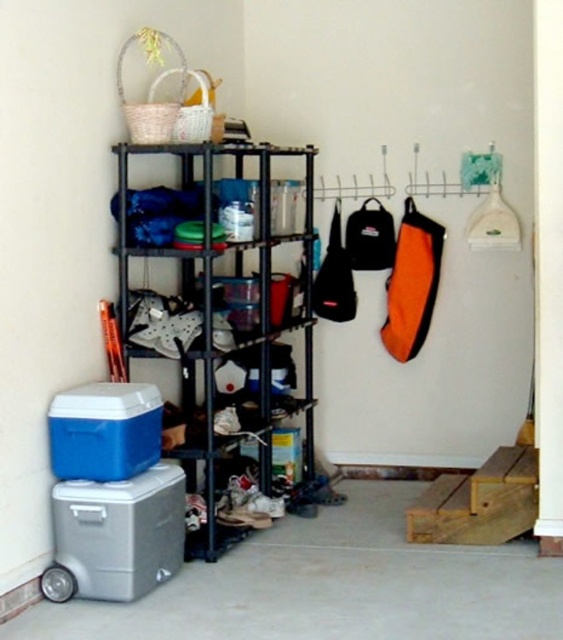
You are moving a gray plastic cooler at lower left and want to place it in front of the black metal shelf at center. Is the cooler currently positioned behind the shelf?

The gray plastic cooler at lower left is behind the black metal shelf at center, so yes, it is currently positioned behind the shelf.

You are organizing items in the utility area and need to move the gray plastic cooler at lower left and blue plastic cooler at lower left. Which cooler is closer to the right edge of the shelving unit?

The gray plastic cooler at lower left is positioned on the right side of the blue plastic cooler at lower left, so the gray plastic cooler at lower left is closer to the right edge of the shelving unit.

You are organizing items in the utility area and need to place a tall ladder that is 2 meters in height. The ladder must be placed against a wall without touching any items. Which object between the black metal shelf at center and the blue plastic cooler at lower left is safer to position the ladder near?

The blue plastic cooler at lower left is safer to position the ladder near because it has a smaller height compared to the black metal shelf at center, reducing the risk of the ladder touching it when placed against the wall.